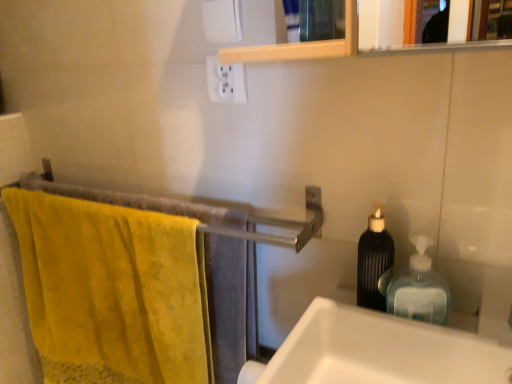
Question: Is the surface of yellow cotton towel at left in direct contact with translucent plastic soap dispenser at right, arranged as the first bottle when viewed from the right?

Choices:
 (A) no
 (B) yes

Answer: (A)

Question: From the image's perspective, is yellow cotton towel at left on translucent plastic soap dispenser at right, placed as the 2th bottle when sorted from left to right?

Choices:
 (A) yes
 (B) no

Answer: (B)

Question: Is yellow cotton towel at left shorter than translucent plastic soap dispenser at right, arranged as the first bottle when viewed from the right?

Choices:
 (A) yes
 (B) no

Answer: (B)

Question: Is yellow cotton towel at left facing away from translucent plastic soap dispenser at right, arranged as the first bottle when viewed from the right?

Choices:
 (A) no
 (B) yes

Answer: (A)

Question: Is translucent plastic soap dispenser at right, placed as the 2th bottle when sorted from left to right, a part of yellow cotton towel at left?

Choices:
 (A) no
 (B) yes

Answer: (A)

Question: Is yellow cotton towel at left in front of or behind black textured bottle at right, the 1th bottle positioned from the left, in the image?

Choices:
 (A) behind
 (B) front

Answer: (A)

Question: Choose the correct answer: Is yellow cotton towel at left inside black textured bottle at right, the 2th bottle from the right, or outside it?

Choices:
 (A) inside
 (B) outside

Answer: (B)

Question: From the image's perspective, relative to black textured bottle at right, the 1th bottle positioned from the left, is yellow cotton towel at left above or below?

Choices:
 (A) above
 (B) below

Answer: (B)

Question: Considering the positions of yellow cotton towel at left and black textured bottle at right, the 1th bottle positioned from the left, in the image, is yellow cotton towel at left wider or thinner than black textured bottle at right, the 1th bottle positioned from the left,?

Choices:
 (A) wide
 (B) thin

Answer: (A)

Question: Is translucent plastic soap dispenser at right, arranged as the first bottle when viewed from the right, situated inside white plastic outlet at upper center or outside?

Choices:
 (A) inside
 (B) outside

Answer: (B)

Question: Considering the positions of translucent plastic soap dispenser at right, placed as the 2th bottle when sorted from left to right, and white plastic outlet at upper center in the image, is translucent plastic soap dispenser at right, placed as the 2th bottle when sorted from left to right, bigger or smaller than white plastic outlet at upper center?

Choices:
 (A) small
 (B) big

Answer: (B)

Question: In terms of width, does translucent plastic soap dispenser at right, placed as the 2th bottle when sorted from left to right, look wider or thinner when compared to white plastic outlet at upper center?

Choices:
 (A) wide
 (B) thin

Answer: (A)

Question: From a real-world perspective, is translucent plastic soap dispenser at right, placed as the 2th bottle when sorted from left to right, physically located above or below white plastic outlet at upper center?

Choices:
 (A) below
 (B) above

Answer: (A)

Question: Looking at their shapes, would you say white glossy sink at right is wider or thinner than translucent plastic soap dispenser at right, arranged as the first bottle when viewed from the right?

Choices:
 (A) wide
 (B) thin

Answer: (A)

Question: Relative to translucent plastic soap dispenser at right, placed as the 2th bottle when sorted from left to right, is white glossy sink at right in front or behind?

Choices:
 (A) behind
 (B) front

Answer: (B)